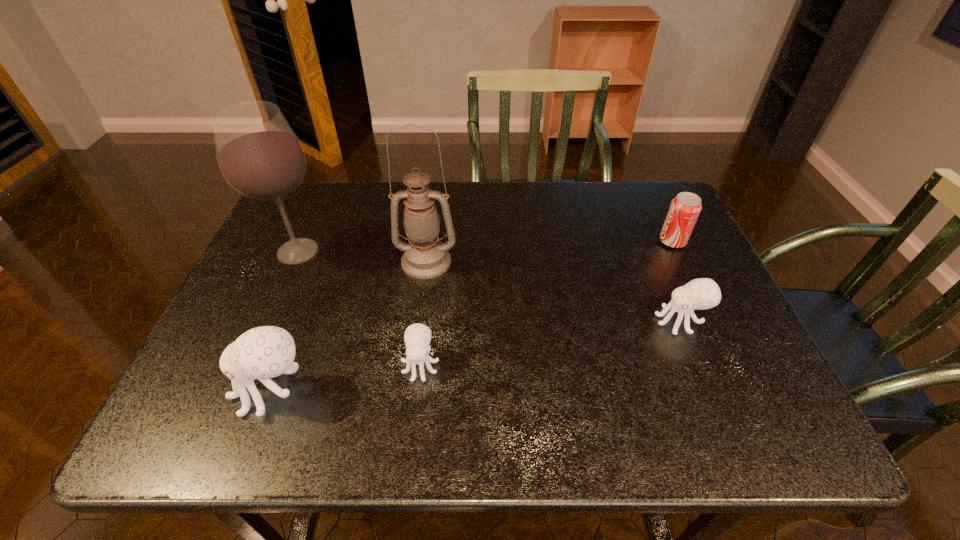
Please mark a free spot for a new octopus_(food) to balance the arrangement. Please provide its 2D coordinates. Your answer should be formatted as a tuple, i.e. [(x, y)], where the tuple contains the x and y coordinates of a point satisfying the conditions above.

[(556, 342)]